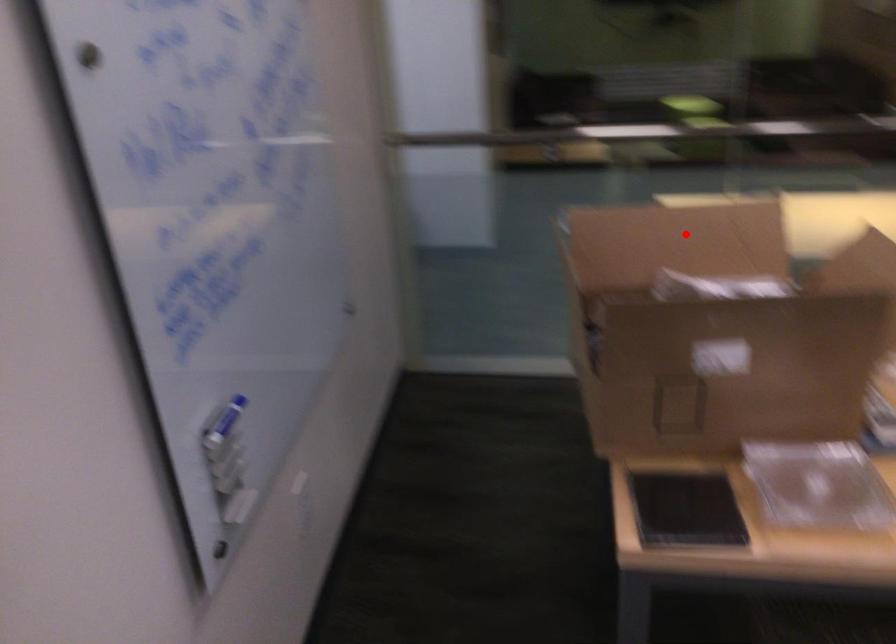
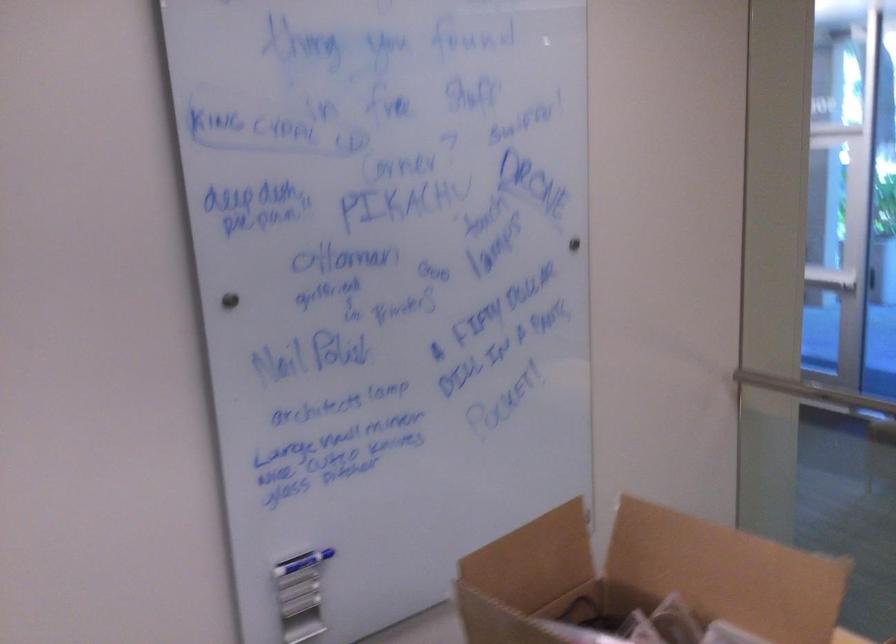
Find the pixel in the second image that matches the highlighted location in the first image.

(727, 573)